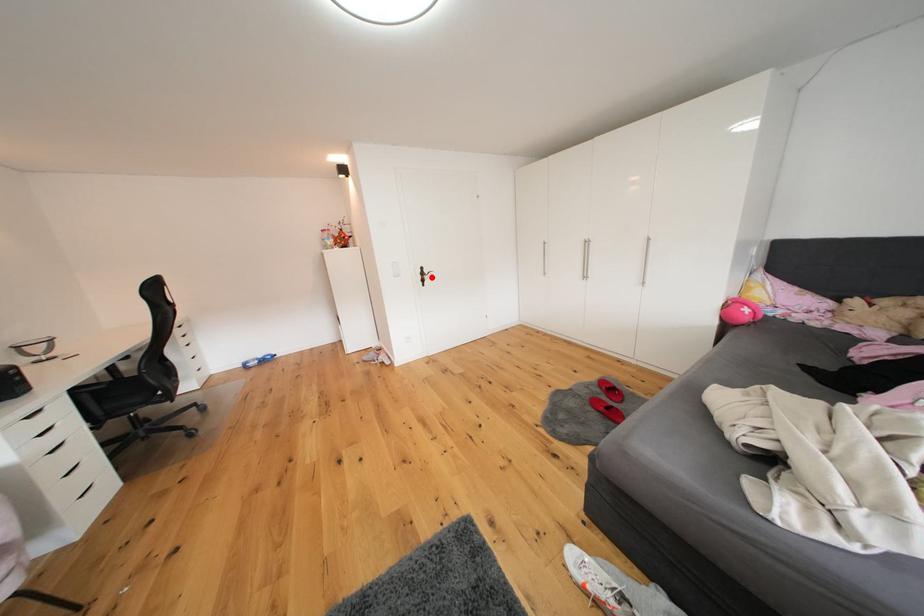
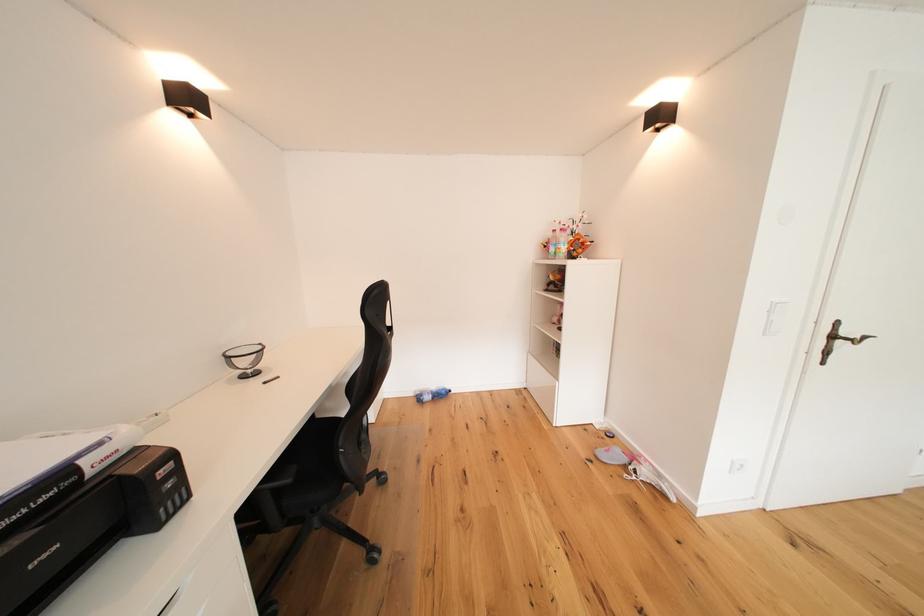
Locate, in the second image, the point that corresponds to the highlighted location in the first image.

(843, 339)